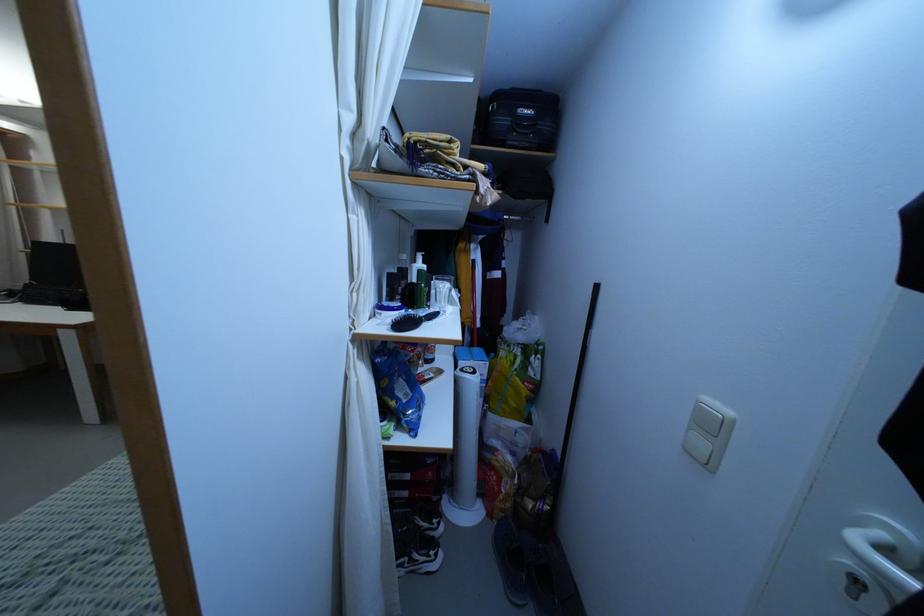
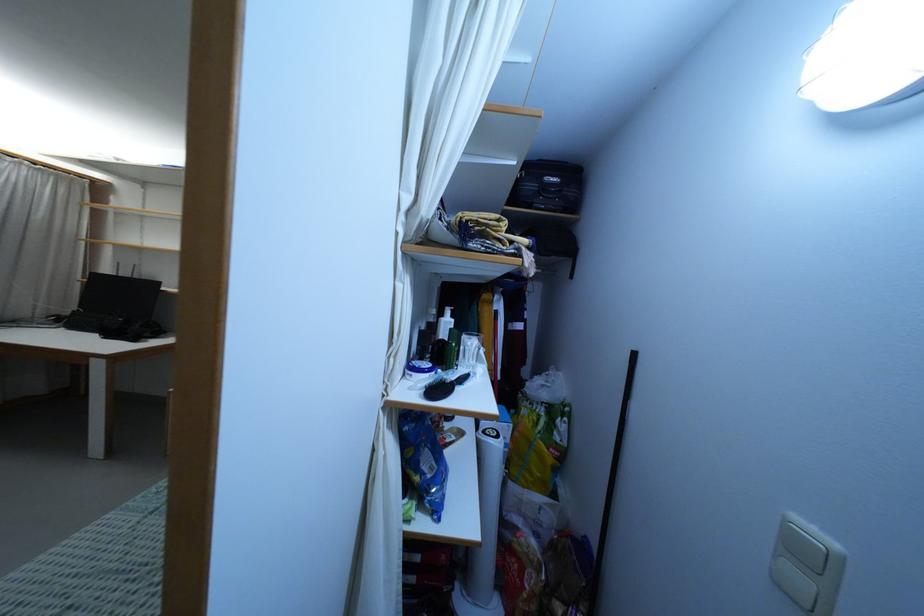
Question: What movement of the cameraman would produce the second image?

Choices:
 (A) Left
 (B) Right
 (C) Forward
 (D) Backward

Answer: (A)